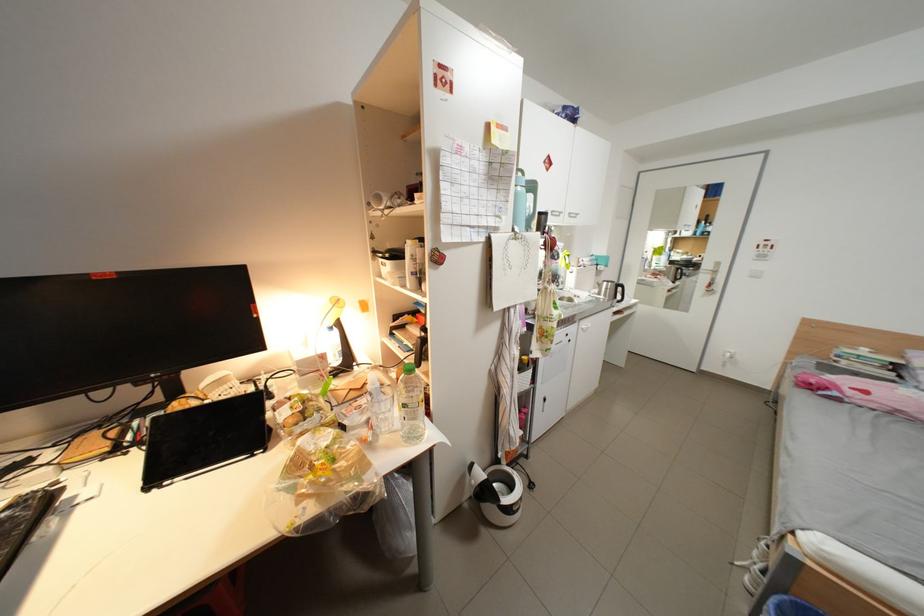
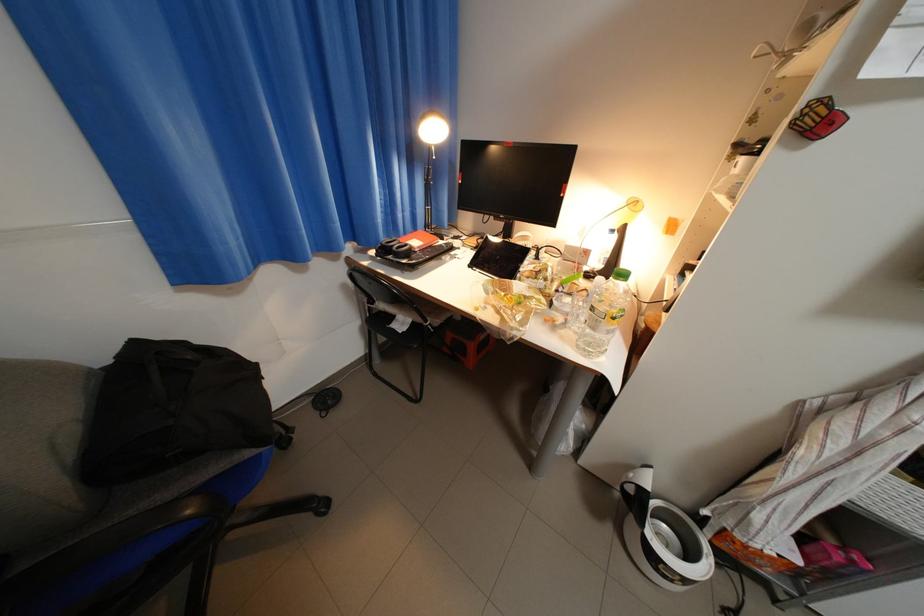
The images are taken continuously from a first-person perspective. In which direction is your viewpoint rotating?

The camera's rotation is toward left-down.